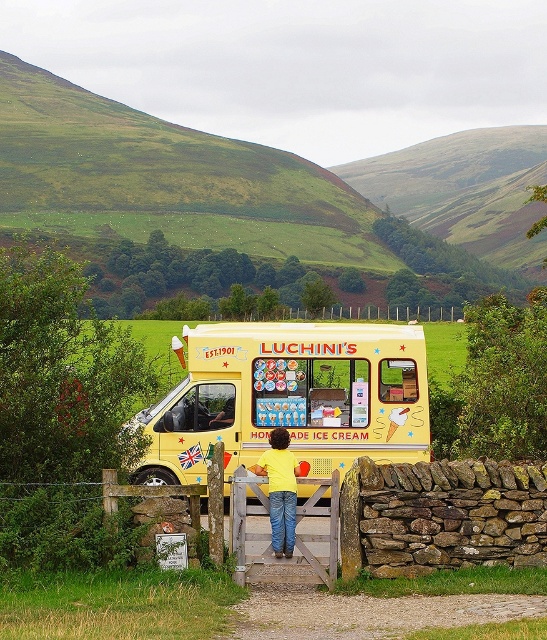
You are standing at the entrance of the ice cream van and want to find the yellow matte shirt at center. Where should you look relative to the van?

The yellow matte shirt at center is located at the open door of the van, as described in the scene.

You are a photographer planning to take a picture of the green grassy hillside at upper left and the yellow matte shirt at center. Based on their sizes in the image, which one should you focus on to ensure it appears more prominent in the final photo?

The green grassy hillside at upper left is larger in size than the yellow matte shirt at center, so focusing on it will make it appear more prominent in the photo.